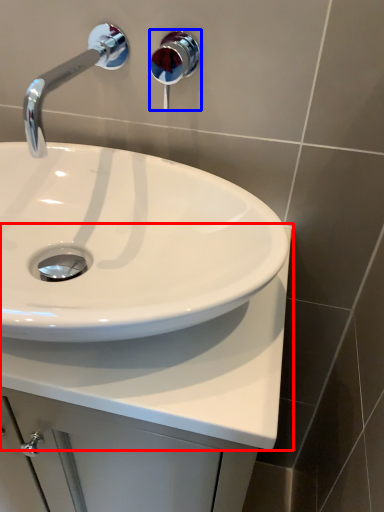
Question: Which of the following is the closest to the observer, counter top (highlighted by a red box) or shower (highlighted by a blue box)?

Choices:
 (A) counter top
 (B) shower

Answer: (A)